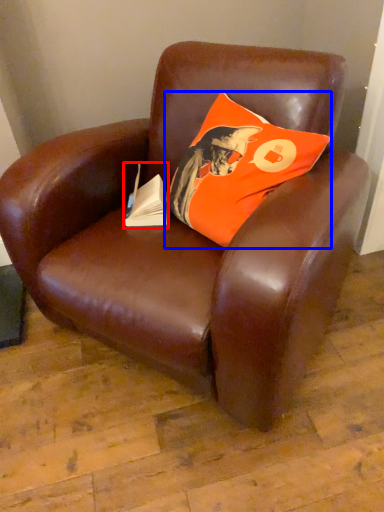
Question: Which object appears farthest to the camera in this image, paperback book (highlighted by a red box) or pillow (highlighted by a blue box)?

Choices:
 (A) paperback book
 (B) pillow

Answer: (A)